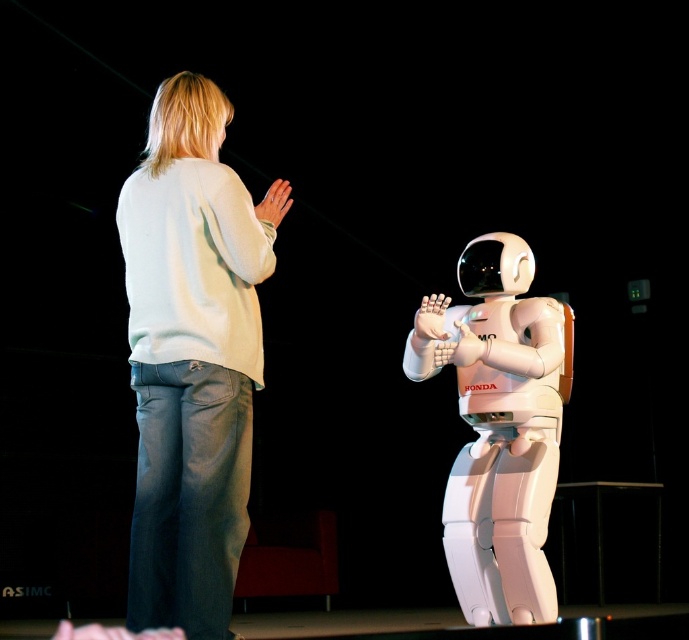
Who is more distant from viewer, (269, 196) or (469, 308)?

Point (469, 308)

Does white cotton sweater at upper left have a greater height compared to white matte astronaut at center?

Yes, white cotton sweater at upper left is taller than white matte astronaut at center.

This screenshot has width=689, height=640. What do you see at coordinates (192, 356) in the screenshot? I see `white cotton sweater at upper left` at bounding box center [192, 356].

Where is `white cotton sweater at upper left`? The height and width of the screenshot is (640, 689). white cotton sweater at upper left is located at coordinates (192, 356).